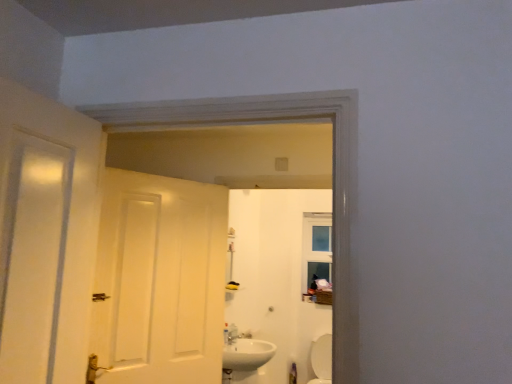
Describe the element at coordinates (322, 359) in the screenshot. I see `white glossy toilet at lower right` at that location.

I want to click on white matte door at center, so click(x=160, y=280).

The width and height of the screenshot is (512, 384). I want to click on white glossy sink at lower center, so click(247, 354).

Is point (261, 177) farther from camera compared to point (313, 379)?

No, (261, 177) is closer to viewer.

Is white glossy mirror at upper center with white glossy toilet at lower right?

They are not placed beside each other.

Does white glossy mirror at upper center have a lesser width compared to white glossy toilet at lower right?

Indeed, white glossy mirror at upper center has a lesser width compared to white glossy toilet at lower right.

Is the position of white glossy mirror at upper center less distant than that of white glossy toilet at lower right?

That is True.

Are white glossy toilet at lower right and white glossy sink at lower center beside each other?

They are not placed beside each other.

Which is behind, point (328, 379) or point (242, 362)?

The point (328, 379) is behind.

Is the position of white glossy toilet at lower right less distant than that of white glossy sink at lower center?

No, white glossy toilet at lower right is behind white glossy sink at lower center.

From the image's perspective, would you say white glossy toilet at lower right is positioned over white glossy sink at lower center?

Actually, white glossy toilet at lower right appears below white glossy sink at lower center in the image.

Measure the distance from white glossy mirror at upper center to white glossy sink at lower center.

They are 31.44 inches apart.

In terms of size, does white glossy mirror at upper center appear bigger or smaller than white glossy sink at lower center?

Considering their sizes, white glossy mirror at upper center takes up less space than white glossy sink at lower center.

Is white glossy mirror at upper center in front of or behind white glossy sink at lower center in the image?

white glossy mirror at upper center is positioned closer to the viewer than white glossy sink at lower center.

Is white glossy mirror at upper center looking in the opposite direction of white glossy sink at lower center?

Yes, white glossy mirror at upper center's orientation is away from white glossy sink at lower center.

Consider the image. Does white glossy mirror at upper center have a lesser width compared to white matte door at center?

Correct, the width of white glossy mirror at upper center is less than that of white matte door at center.

Which object is more forward, white glossy mirror at upper center or white matte door at center?

white glossy mirror at upper center is in front.

Image resolution: width=512 pixels, height=384 pixels. What are the coordinates of `door below the white glossy mirror at upper center (from the image's perspective)` in the screenshot? It's located at [x=160, y=280].

Is white glossy mirror at upper center outside of white matte door at center?

white glossy mirror at upper center is positioned outside white matte door at center.

Would you say white matte door at center is outside white glossy toilet at lower right?

Absolutely, white matte door at center is external to white glossy toilet at lower right.

From the image's perspective, relative to white glossy toilet at lower right, is white matte door at center above or below?

Based on their image positions, white matte door at center is located above white glossy toilet at lower right.

Is white matte door at center bigger than white glossy toilet at lower right?

Yes.

Is white matte door at center oriented away from white glossy toilet at lower right?

white matte door at center does not have its back to white glossy toilet at lower right.

Is white glossy toilet at lower right oriented away from white matte door at center?

That's not correct — white glossy toilet at lower right is not looking away from white matte door at center.

Which of these two, white glossy toilet at lower right or white matte door at center, is smaller?

Smaller between the two is white glossy toilet at lower right.

Does white glossy toilet at lower right lie behind white matte door at center?

That is True.

Can we say white glossy toilet at lower right lies outside white matte door at center?

Absolutely, white glossy toilet at lower right is external to white matte door at center.

Does white glossy toilet at lower right have a greater width compared to white glossy mirror at upper center?

Correct, the width of white glossy toilet at lower right exceeds that of white glossy mirror at upper center.

Is white glossy toilet at lower right with white glossy mirror at upper center?

No, white glossy toilet at lower right is not touching white glossy mirror at upper center.

From a real-world perspective, is white glossy toilet at lower right positioned above or below white glossy mirror at upper center?

From a real-world perspective, white glossy toilet at lower right is physically below white glossy mirror at upper center.

Find the location of a particular element. mirror on the left of white glossy toilet at lower right is located at coordinates point(256,219).

Identify the location of sink that appears in front of the white glossy toilet at lower right. (247, 354).

Which object lies further to the anchor point white matte door at center, white glossy mirror at upper center or white glossy toilet at lower right?

white glossy toilet at lower right is further to white matte door at center.

Looking at the image, which one is located closer to white glossy toilet at lower right, white matte door at center or white glossy mirror at upper center?

The object closer to white glossy toilet at lower right is white glossy mirror at upper center.

Based on their spatial positions, is white glossy sink at lower center or white matte door at center further from white glossy mirror at upper center?

white matte door at center lies further to white glossy mirror at upper center than the other object.

Looking at the image, which one is located closer to white glossy sink at lower center, white glossy mirror at upper center or white glossy toilet at lower right?

white glossy mirror at upper center lies closer to white glossy sink at lower center than the other object.

Estimate the real-world distances between objects in this image. Which object is closer to white glossy toilet at lower right, white glossy mirror at upper center or white matte door at center?

white glossy mirror at upper center.

From the image, which object appears to be farther from white glossy mirror at upper center, white glossy toilet at lower right or white glossy sink at lower center?

The object further to white glossy mirror at upper center is white glossy sink at lower center.

Which object lies further to the anchor point white glossy mirror at upper center, white matte door at center or white glossy sink at lower center?

white matte door at center is positioned further to the anchor white glossy mirror at upper center.

When comparing their distances from white glossy sink at lower center, does white glossy toilet at lower right or white glossy mirror at upper center seem closer?

Based on the image, white glossy mirror at upper center appears to be nearer to white glossy sink at lower center.

Where is `sink between white glossy mirror at upper center and white glossy toilet at lower right in the front-back direction`? This screenshot has width=512, height=384. sink between white glossy mirror at upper center and white glossy toilet at lower right in the front-back direction is located at coordinates click(x=247, y=354).

At what (x,y) coordinates should I click in order to perform the action: click on door between white glossy mirror at upper center and white glossy toilet at lower right along the z-axis. Please return your answer as a coordinate pair (x, y). This screenshot has width=512, height=384. Looking at the image, I should click on (160, 280).

Identify the location of door between white glossy mirror at upper center and white glossy sink at lower center along the z-axis. The width and height of the screenshot is (512, 384). (160, 280).

Where is `sink between white matte door at center and white glossy toilet at lower right from front to back`? sink between white matte door at center and white glossy toilet at lower right from front to back is located at coordinates (247, 354).